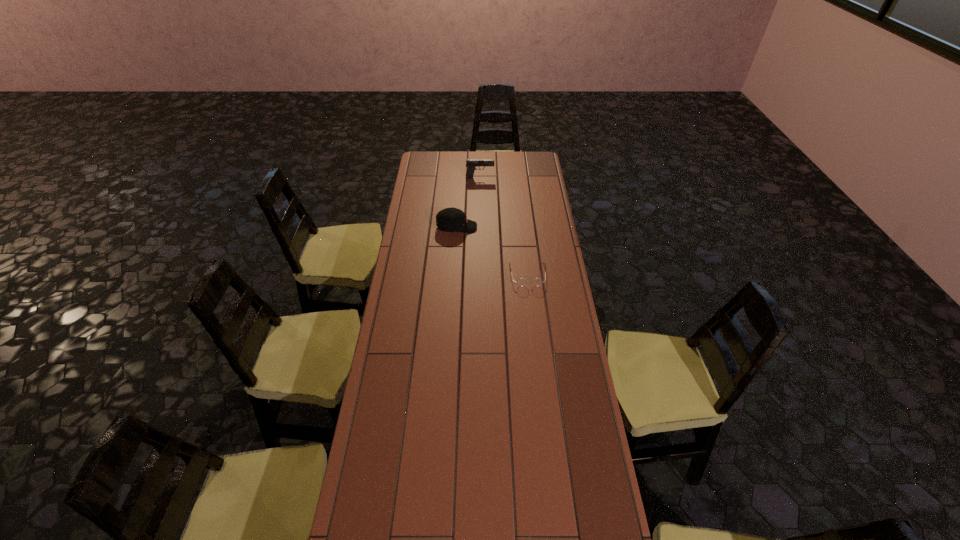
Find the location of a particular element. pistol is located at coordinates (470, 163).

The image size is (960, 540). In order to click on the second farthest object in this screenshot , I will do `click(452, 219)`.

You are a GUI agent. You are given a task and a screenshot of the screen. Output one action in this format:
    pyautogui.click(x=<x>, y=<y>)
    Task: Click on the shortest object
    The height and width of the screenshot is (540, 960).
    Given the screenshot: What is the action you would take?
    pyautogui.click(x=522, y=281)

Where is `the nearest object`? The width and height of the screenshot is (960, 540). the nearest object is located at coordinates (522, 281).

Locate an element on the screen. The image size is (960, 540). vacant space located 0.200m aim along the barrel of the pistol is located at coordinates (529, 178).

The image size is (960, 540). I want to click on vacant space located with a logo on the front of the baseball cap, so click(x=499, y=227).

Identify the location of vacant space located through the lenses of the spectacles. (534, 331).

You are a GUI agent. You are given a task and a screenshot of the screen. Output one action in this format:
    pyautogui.click(x=<x>, y=<y>)
    Task: Click on the object that is positioned at the left edge
    This screenshot has width=960, height=540.
    Given the screenshot: What is the action you would take?
    (452, 219)

Locate an element on the screen. Image resolution: width=960 pixels, height=540 pixels. object at the right edge is located at coordinates (522, 281).

Locate an element on the screen. This screenshot has width=960, height=540. vacant space at the far edge of the desktop is located at coordinates (496, 152).